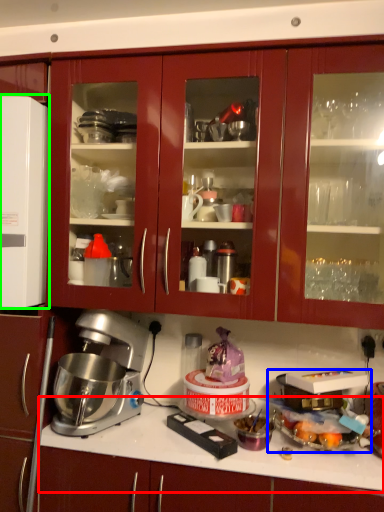
Question: Considering the real-world distances, which object is closest to countertop (highlighted by a red box)? appliance (highlighted by a blue box) or appliance (highlighted by a green box).

Choices:
 (A) appliance
 (B) appliance

Answer: (A)